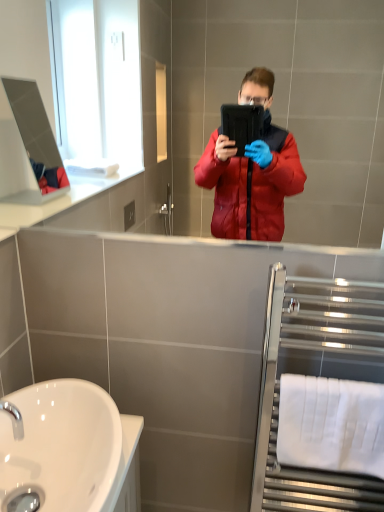
Question: From a real-world perspective, is white glossy sink at lower left physically located above or below chrome metallic tap at lower left?

Choices:
 (A) above
 (B) below

Answer: (B)

Question: Choose the correct answer: Is white glossy sink at lower left inside chrome metallic tap at lower left or outside it?

Choices:
 (A) inside
 (B) outside

Answer: (B)

Question: Which of these objects is positioned farthest from the polished chrome towel rack at right?

Choices:
 (A) chrome metallic tap at lower left
 (B) white glossy sink at lower left
 (C) white fabric towel bar at lower right

Answer: (A)

Question: Which is nearer to the white glossy sink at lower left?

Choices:
 (A) white fabric towel bar at lower right
 (B) polished chrome towel rack at right
 (C) chrome metallic tap at lower left

Answer: (C)